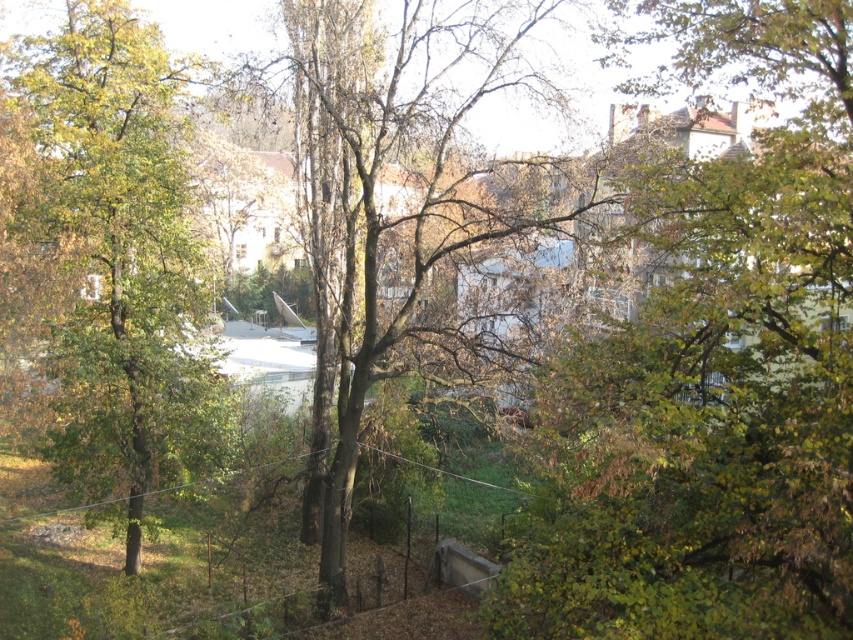
You are standing in the urban landscape scene and want to take a photo of the green leafy tree at upper right. If your camera has a maximum focus range of 30 feet, will you be able to capture the tree clearly?

The green leafy tree at upper right is 35.60 feet away from the viewer. Since the camera can only focus up to 30 feet, it won not be able to capture the tree clearly.

You are a gardener planning to plant a new tree in the urban landscape. You see the green leafy tree at upper right and the green matte tree at center. Which tree is located to the right of the other?

The green leafy tree at upper right is positioned on the right side of green matte tree at center.

You are a city planner assessing the space between two trees in an urban area. You need to install a new bench that requires at least 20 meters of clearance between the green leafy tree at upper right and the green matte tree at center. Based on the image, will the bench fit in this location?

The distance between the green leafy tree at upper right and the green matte tree at center is 21.16 meters, which exceeds the required 20 meters of clearance. Therefore, the bench can be installed in this location.